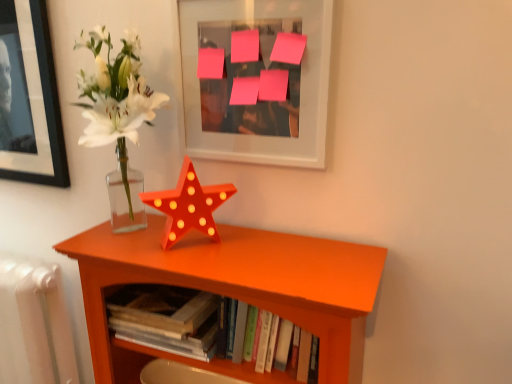
Where is `free space in front of matte glass vase at center left`? The height and width of the screenshot is (384, 512). free space in front of matte glass vase at center left is located at coordinates (204, 272).